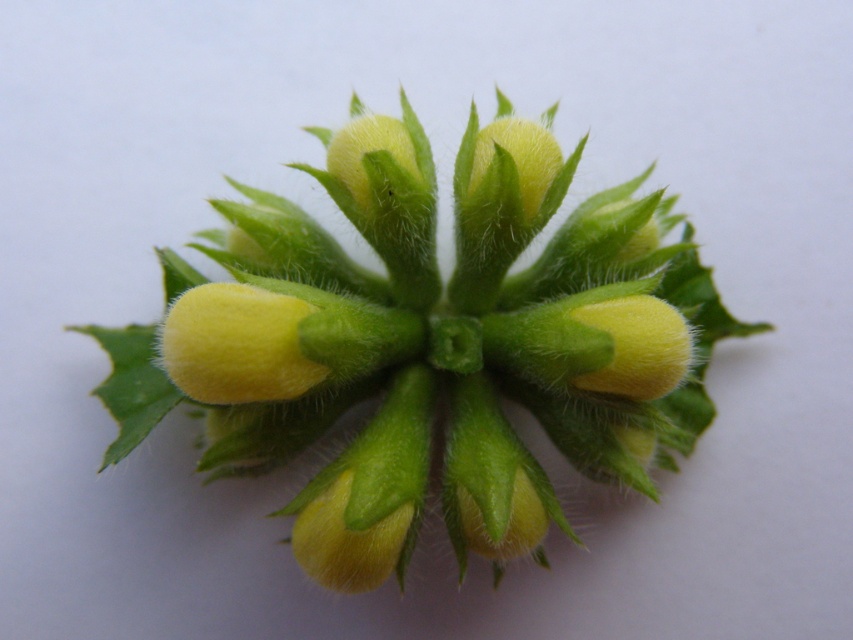
Question: Which object is farther from the camera taking this photo?

Choices:
 (A) yellow fuzzy flower at center
 (B) fuzzy yellow buds at center

Answer: (B)

Question: Considering the relative positions of fuzzy yellow buds at center and yellow fuzzy flower at center in the image provided, where is fuzzy yellow buds at center located with respect to yellow fuzzy flower at center?

Choices:
 (A) left
 (B) right

Answer: (B)

Question: Among these points, which one is nearest to the camera?

Choices:
 (A) (305, 388)
 (B) (305, 224)

Answer: (A)

Question: Is fuzzy yellow buds at center behind yellow fuzzy flower at center?

Choices:
 (A) yes
 (B) no

Answer: (A)

Question: Does fuzzy yellow buds at center lie behind yellow fuzzy flower at center?

Choices:
 (A) no
 (B) yes

Answer: (B)